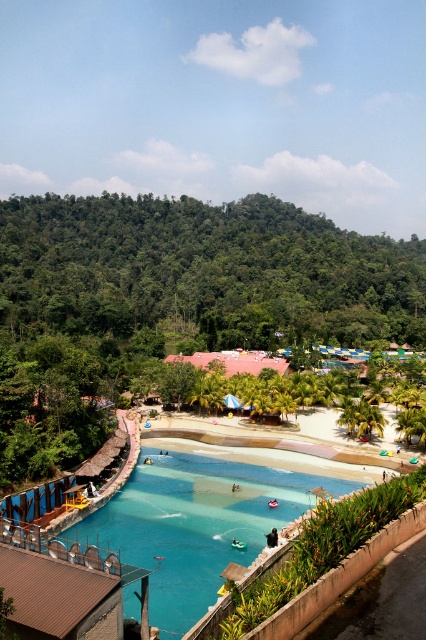
From the picture: You are planning to take a photo of the green leafy trees at upper left and the blue glossy water at center. Which object will occupy more space in your photo?

The green leafy trees at upper left will occupy more space in the photo because their width is larger than the blue glossy water at center.

You are standing at the water park pool and want to take a photo of the green leafy trees at upper left. If your camera has a maximum zoom range of 150 meters, will you be able to capture the trees clearly in your photo?

The green leafy trees at upper left are 172.25 meters away from the camera. Since the camera can only zoom up to 150 meters, you won cannot capture the trees clearly in your photo.

You are a visitor at the water park and want to take a photo of the blue glossy water at center while also capturing the green leafy trees at upper left in the background. Which direction should you face to include both in your shot?

You should face to the right of the blue glossy water at center to include the green leafy trees at upper left in the background since the green leafy trees at upper left is located to the left of the blue glossy water at center.